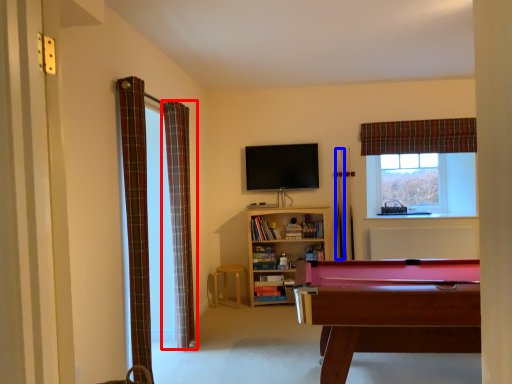
Question: Which point is further to the camera, curtain (highlighted by a red box) or cue (highlighted by a blue box)?

Choices:
 (A) curtain
 (B) cue

Answer: (B)